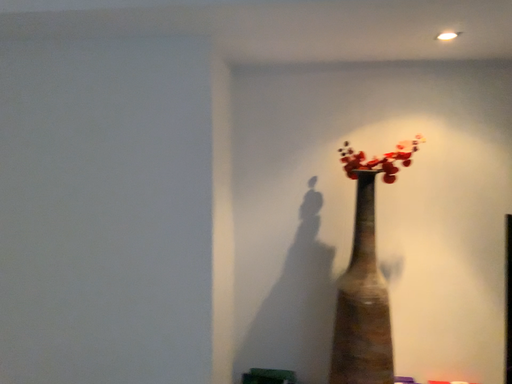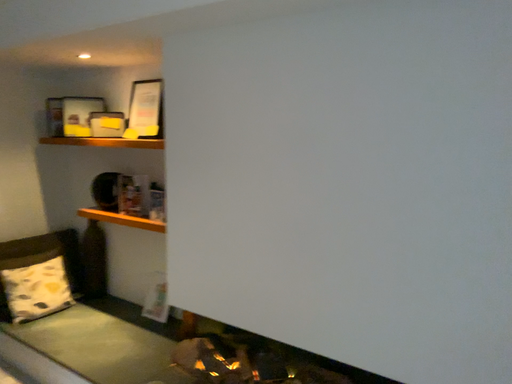
Question: How did the camera likely rotate when shooting the video?

Choices:
 (A) rotated left
 (B) rotated right

Answer: (A)